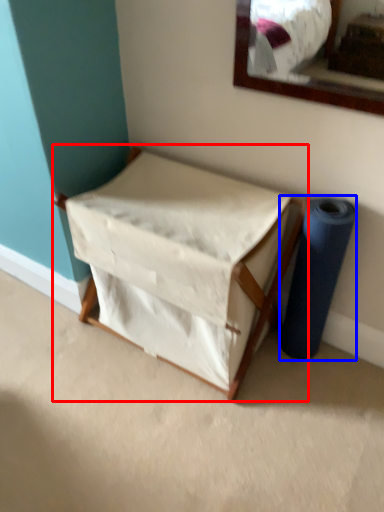
Question: Which object is closer to the camera taking this photo, furniture (highlighted by a red box) or duct tape (highlighted by a blue box)?

Choices:
 (A) furniture
 (B) duct tape

Answer: (A)